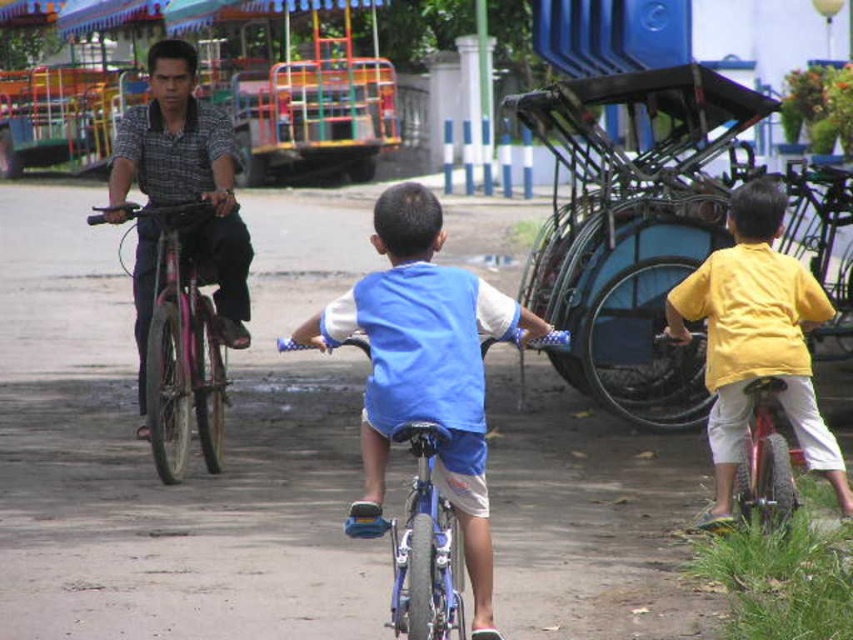
Does blue fabric shirt at center lie behind yellow matte shirt at right?

No.

From the picture: Can you confirm if blue fabric shirt at center is positioned to the left of yellow matte shirt at right?

Correct, you'll find blue fabric shirt at center to the left of yellow matte shirt at right.

Does point (436, 465) come farther from viewer compared to point (764, 244)?

No.

The image size is (853, 640). I want to click on blue fabric shirt at center, so click(424, 369).

Which is more to the left, metallic blue tricycle at right or blue fabric shirt at center?

blue fabric shirt at center is more to the left.

Who is positioned more to the right, metallic blue tricycle at right or blue fabric shirt at center?

Positioned to the right is metallic blue tricycle at right.

Which is in front, point (654, 209) or point (440, 378)?

Point (440, 378) is more forward.

The image size is (853, 640). Identify the location of metallic blue tricycle at right. (634, 227).

Is metallic blue tricycle at right above yellow matte shirt at right?

Indeed, metallic blue tricycle at right is positioned over yellow matte shirt at right.

Is metallic blue tricycle at right to the left of yellow matte shirt at right from the viewer's perspective?

No, metallic blue tricycle at right is not to the left of yellow matte shirt at right.

In order to click on metallic blue tricycle at right in this screenshot , I will do `click(634, 227)`.